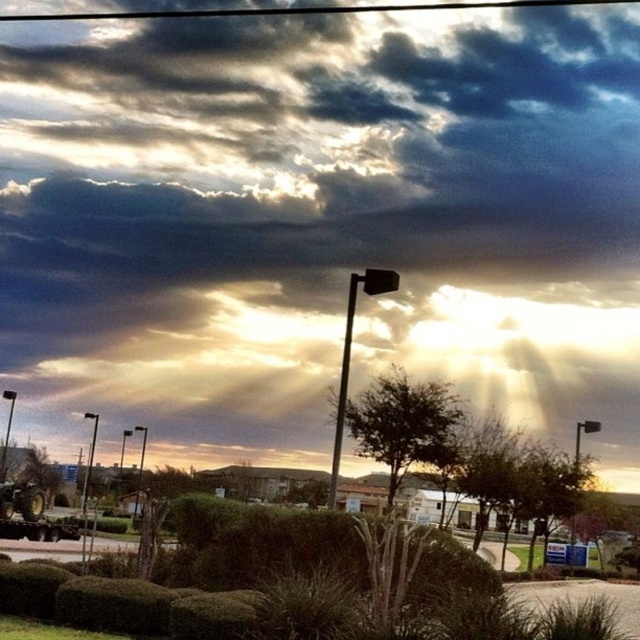
Measure the distance between cloudy sky at upper center and metallic pole at upper left.

A distance of 24.49 meters exists between cloudy sky at upper center and metallic pole at upper left.

Is point (426, 234) positioned behind point (84, 492)?

Yes.

Does point (301, 253) lie in front of point (92, 538)?

No, it is behind (92, 538).

Identify the location of cloudy sky at upper center. tap(317, 224).

Can you confirm if cloudy sky at upper center is taller than black metal pole at center?

Yes, cloudy sky at upper center is taller than black metal pole at center.

Is cloudy sky at upper center below black metal pole at center?

No, cloudy sky at upper center is not below black metal pole at center.

Which is behind, point (230, 100) or point (339, 410)?

The point (230, 100) is more distant.

This screenshot has height=640, width=640. Identify the location of cloudy sky at upper center. (317, 224).

Which is in front, point (333, 506) or point (83, 540)?

Positioned in front is point (83, 540).

You are a GUI agent. You are given a task and a screenshot of the screen. Output one action in this format:
    pyautogui.click(x=<x>, y=<y>)
    Task: Click on the black metal pole at center
    The width and height of the screenshot is (640, 640).
    Given the screenshot: What is the action you would take?
    pyautogui.click(x=342, y=387)